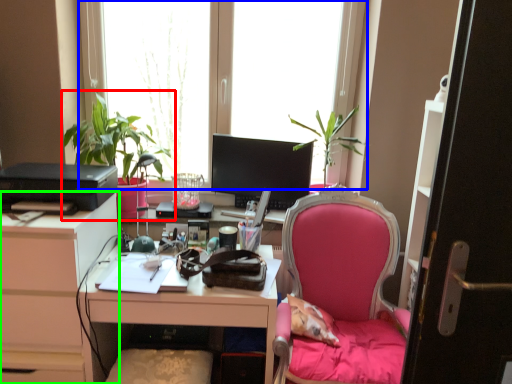
Question: Which is nearer to the houseplant (highlighted by a red box)? window (highlighted by a blue box) or cabinetry (highlighted by a green box).

Choices:
 (A) window
 (B) cabinetry

Answer: (A)